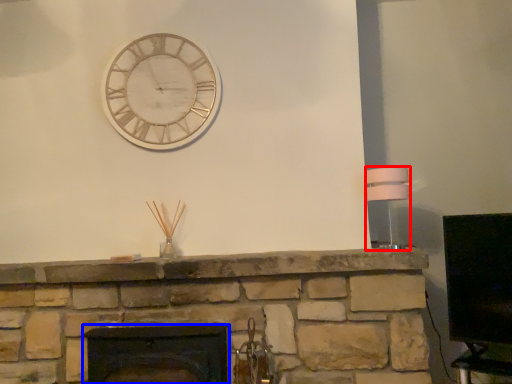
Question: Which point is further to the camera, lamp (highlighted by a red box) or fireplace (highlighted by a blue box)?

Choices:
 (A) lamp
 (B) fireplace

Answer: (A)